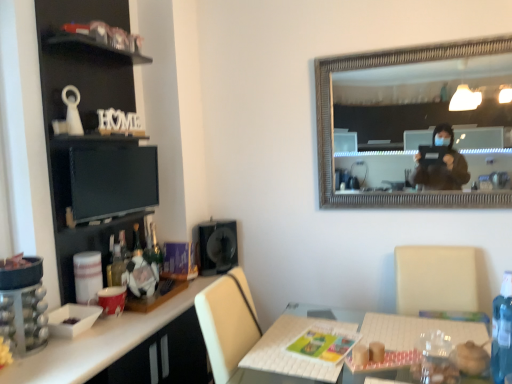
Question: Is black matte cabinet at left facing away from black glossy computer monitor at upper left?

Choices:
 (A) no
 (B) yes

Answer: (B)

Question: Does black matte cabinet at left have a lesser width compared to black glossy computer monitor at upper left?

Choices:
 (A) no
 (B) yes

Answer: (A)

Question: Is black matte cabinet at left positioned beyond the bounds of black glossy computer monitor at upper left?

Choices:
 (A) yes
 (B) no

Answer: (A)

Question: Is the position of black matte cabinet at left more distant than that of black glossy computer monitor at upper left?

Choices:
 (A) yes
 (B) no

Answer: (B)

Question: Is black glossy computer monitor at upper left inside black matte cabinet at left?

Choices:
 (A) yes
 (B) no

Answer: (A)

Question: Considering the positions of point (223, 253) and point (88, 213), is point (223, 253) closer or farther from the camera than point (88, 213)?

Choices:
 (A) farther
 (B) closer

Answer: (A)

Question: Looking at the image, does black matte speaker at center seem bigger or smaller compared to black glossy computer monitor at upper left?

Choices:
 (A) big
 (B) small

Answer: (A)

Question: Choose the correct answer: Is black matte speaker at center inside black glossy computer monitor at upper left or outside it?

Choices:
 (A) inside
 (B) outside

Answer: (B)

Question: Looking at their shapes, would you say black matte speaker at center is wider or thinner than black glossy computer monitor at upper left?

Choices:
 (A) thin
 (B) wide

Answer: (B)

Question: Is white glossy desk at lower left to the left or to the right of black matte cabinet at left in the image?

Choices:
 (A) left
 (B) right

Answer: (B)

Question: Do you think white glossy desk at lower left is within black matte cabinet at left, or outside of it?

Choices:
 (A) inside
 (B) outside

Answer: (B)

Question: In terms of height, does white glossy desk at lower left look taller or shorter compared to black matte cabinet at left?

Choices:
 (A) short
 (B) tall

Answer: (A)

Question: From a real-world perspective, relative to black matte cabinet at left, is white glossy desk at lower left vertically above or below?

Choices:
 (A) below
 (B) above

Answer: (A)

Question: In terms of width, does clear plastic bottle at lower right look wider or thinner when compared to white glossy desk at lower left?

Choices:
 (A) wide
 (B) thin

Answer: (B)

Question: Considering the relative positions of clear plastic bottle at lower right and white glossy desk at lower left in the image provided, is clear plastic bottle at lower right to the left or to the right of white glossy desk at lower left?

Choices:
 (A) left
 (B) right

Answer: (B)